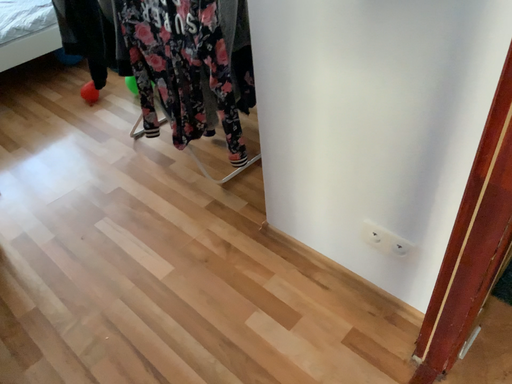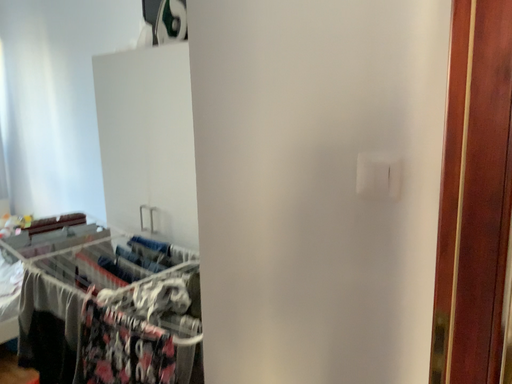
Question: Which way did the camera rotate in the video?

Choices:
 (A) rotated left
 (B) rotated right

Answer: (B)